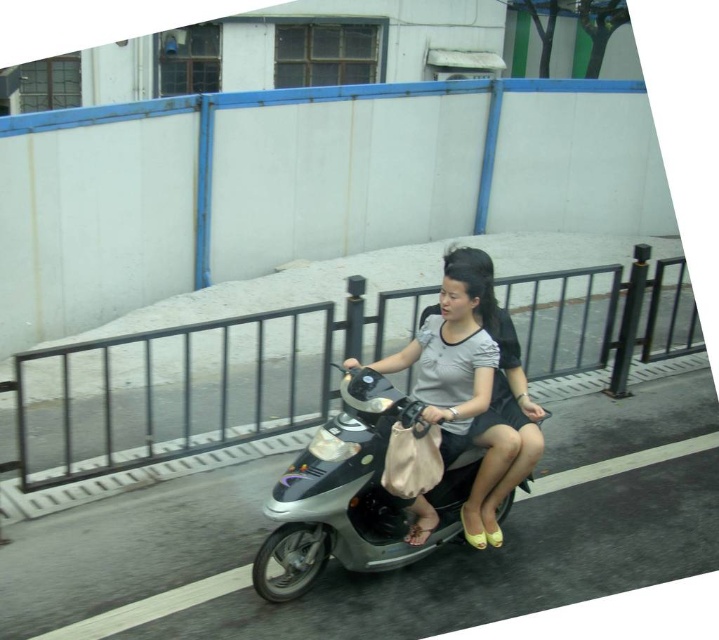
Which is below, black metal rail at center or light gray matte shirt at center?

black metal rail at center is lower down.

Is black metal rail at center positioned in front of light gray matte shirt at center?

No, black metal rail at center is further to the viewer.

What do you see at coordinates (191, 385) in the screenshot?
I see `black metal rail at center` at bounding box center [191, 385].

This screenshot has width=719, height=640. What are the coordinates of `black metal rail at center` in the screenshot? It's located at (191, 385).

Does black metal rail at center appear on the right side of metallic silver scooter at center?

No, black metal rail at center is not to the right of metallic silver scooter at center.

Is point (551, 348) positioned before point (464, 483)?

That is False.

Is point (249, 323) positioned before point (275, 576)?

No, (249, 323) is further to viewer.

Locate an element on the screen. This screenshot has width=719, height=640. black metal rail at center is located at coordinates tap(191, 385).

Is point (315, 566) closer to viewer compared to point (480, 397)?

That is False.

Between metallic silver scooter at center and light gray matte shirt at center, which one is positioned lower?

Positioned lower is metallic silver scooter at center.

Which is behind, point (439, 509) or point (375, 362)?

Positioned behind is point (375, 362).

This screenshot has width=719, height=640. What are the coordinates of `metallic silver scooter at center` in the screenshot? It's located at (352, 496).